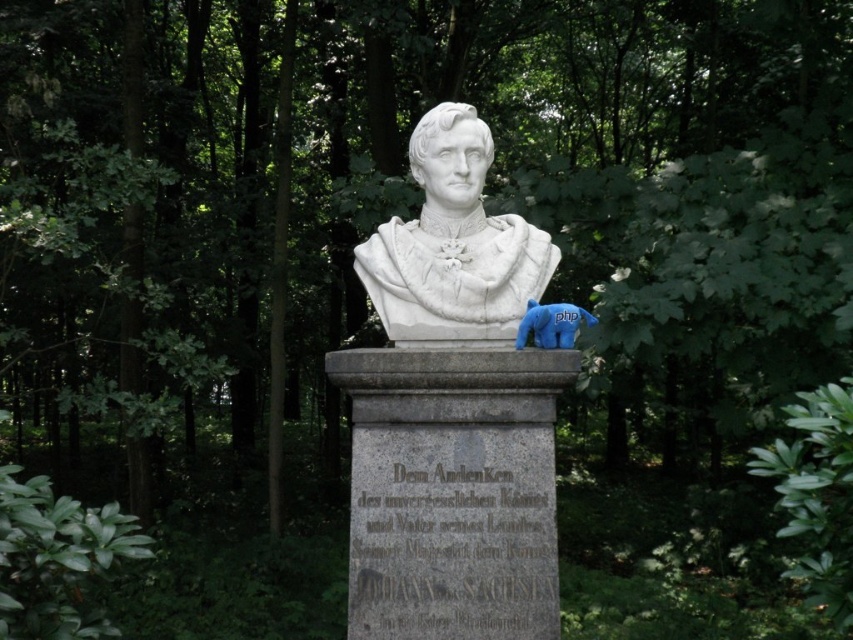
You are an artist trying to sketch the scene. You notice both the white marble bust at center and the blue plush bear at center. Which object should you draw first if you want to capture the larger one in terms of width?

The white marble bust at center should be drawn first since its width is larger than the blue plush bear at center.

You are a visitor in a park and see both the white marble bust at center and the blue plush bear at center. Which object is positioned to the left when viewed from your perspective?

The white marble bust at center is positioned to the left of the blue plush bear at center from the visitor perspective.

You are an archaeologist examining the image of a historical site. You notice a point labeled at coordinates (453,246). What does this point represent?

The point at coordinates (453,246) indicates the white marble bust at center.